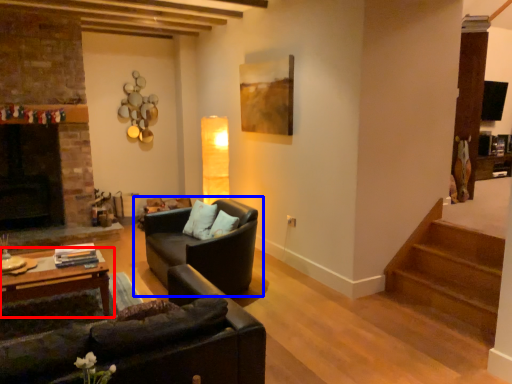
Question: Which object is closer to the camera taking this photo, table (highlighted by a red box) or studio couch (highlighted by a blue box)?

Choices:
 (A) table
 (B) studio couch

Answer: (A)